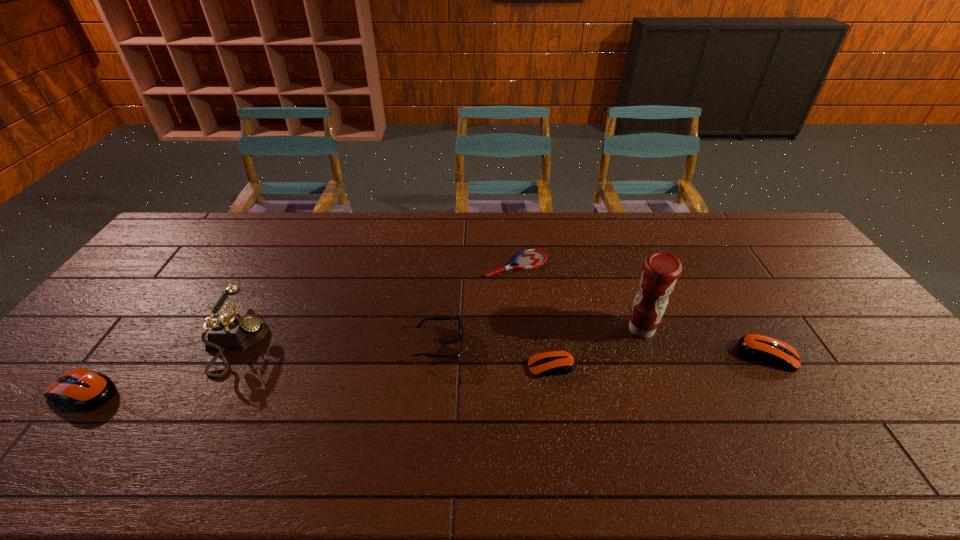
Locate an element on the screen. vacant space in between the leftmost object and the shortest object is located at coordinates (300, 328).

Identify the location of free space between the third object from left to right and the leftmost object. The height and width of the screenshot is (540, 960). (262, 369).

At what (x,y) coordinates should I click in order to perform the action: click on free space between the fifth object from right to left and the leftmost object. Please return your answer as a coordinate pair (x, y). Looking at the image, I should click on (262, 369).

The width and height of the screenshot is (960, 540). In order to click on free point between the leftmost object and the second shortest computer mouse in this screenshot , I will do `click(426, 373)`.

Where is `vacant area between the condiment and the farthest object`? The image size is (960, 540). vacant area between the condiment and the farthest object is located at coordinates (579, 297).

Where is `the sixth closest object to the leftmost object`? This screenshot has width=960, height=540. the sixth closest object to the leftmost object is located at coordinates (764, 349).

Locate an element on the screen. The height and width of the screenshot is (540, 960). object identified as the closest to the shortest object is located at coordinates (460, 326).

This screenshot has width=960, height=540. I want to click on computer mouse identified as the closest to the sunglasses, so click(x=558, y=362).

You are a GUI agent. You are given a task and a screenshot of the screen. Output one action in this format:
    pyautogui.click(x=<x>, y=<y>)
    Task: Click on the computer mouse that stands as the third closest to the third object from left to right
    
    Given the screenshot: What is the action you would take?
    pyautogui.click(x=764, y=349)

You are a GUI agent. You are given a task and a screenshot of the screen. Output one action in this format:
    pyautogui.click(x=<x>, y=<y>)
    Task: Click on the blank space that satisfies the following two spatial constraints: 1. on the front-facing side of the sunglasses; 2. on the back side of the rightmost object
    
    Given the screenshot: What is the action you would take?
    pyautogui.click(x=439, y=355)